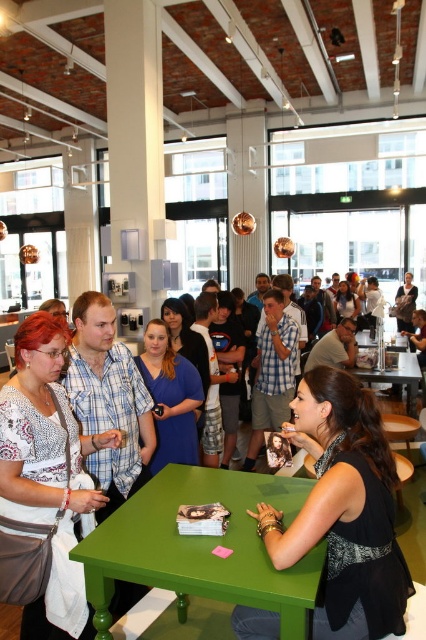
You are a fashion designer observing the clothing items in the office scene. You need to determine which garment is wider between the black matte dress at lower right and the matte white shirt at center. Can you identify which one has a greater width?

The black matte dress at lower right has a greater width than the matte white shirt at center, as its width surpasses that of the matte white shirt at center according to the description.

You are a delivery person who needs to place a large package on the green matte table at center. You are currently standing 2 meters away from the matte white shirt at center. Can you reach the table without moving closer to it?

The distance between the matte white shirt at center and the green matte table at center is 3.56 meters. Since you are 2 meters away from the matte white shirt at center, you would still need to cover an additional 1.56 meters to reach the green matte table at center. Therefore, you cannot place the package on the table without moving closer.